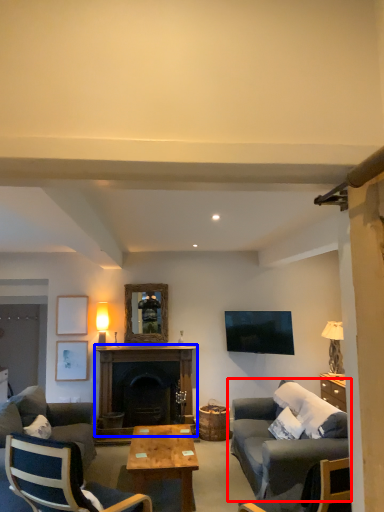
Question: Which point is closer to the camera, studio couch (highlighted by a red box) or fireplace (highlighted by a blue box)?

Choices:
 (A) studio couch
 (B) fireplace

Answer: (A)